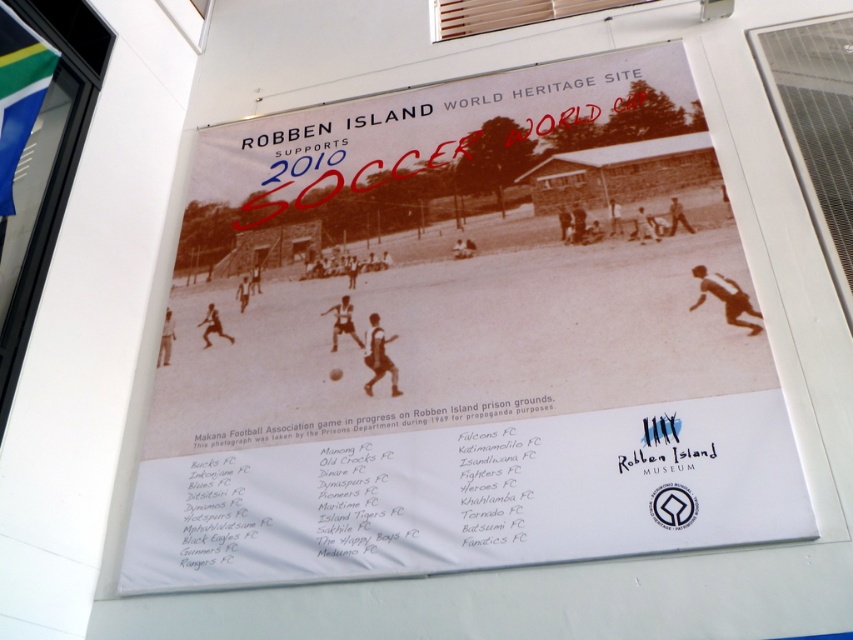
Question: Which point appears farthest from the camera in this image?

Choices:
 (A) (0, 93)
 (B) (236, 397)

Answer: (B)

Question: Can you confirm if black paper poster at center is smaller than green fabric flag at upper left?

Choices:
 (A) no
 (B) yes

Answer: (A)

Question: Considering the relative positions of black paper poster at center and green fabric flag at upper left in the image provided, where is black paper poster at center located with respect to green fabric flag at upper left?

Choices:
 (A) left
 (B) right

Answer: (B)

Question: Which point is closer to the camera taking this photo?

Choices:
 (A) (248, 358)
 (B) (0, 6)

Answer: (B)

Question: Among these objects, which one is farthest from the camera?

Choices:
 (A) black paper poster at center
 (B) green fabric flag at upper left

Answer: (B)

Question: Is black paper poster at center smaller than green fabric flag at upper left?

Choices:
 (A) yes
 (B) no

Answer: (B)